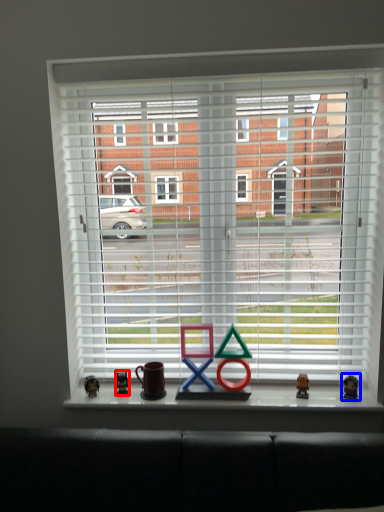
Question: Which object appears closest to the camera in this image, miniature (highlighted by a red box) or miniature (highlighted by a blue box)?

Choices:
 (A) miniature
 (B) miniature

Answer: (B)